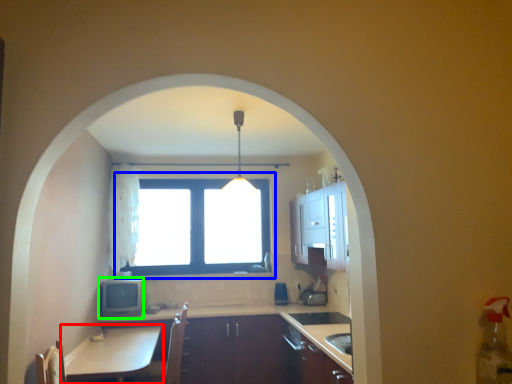
Question: Which object is positioned closest to table (highlighted by a red box)? Select from window (highlighted by a blue box) and appliance (highlighted by a green box).

Choices:
 (A) window
 (B) appliance

Answer: (B)